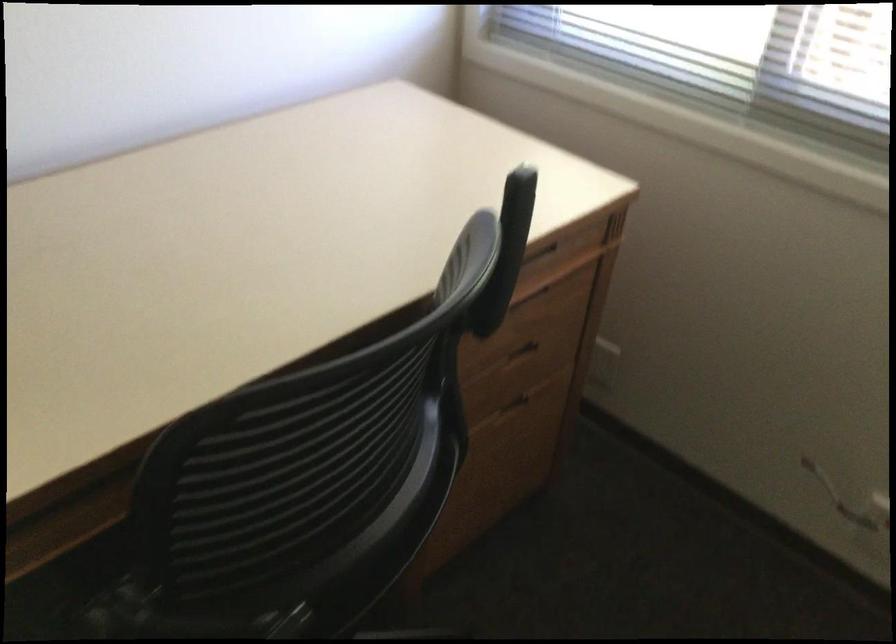
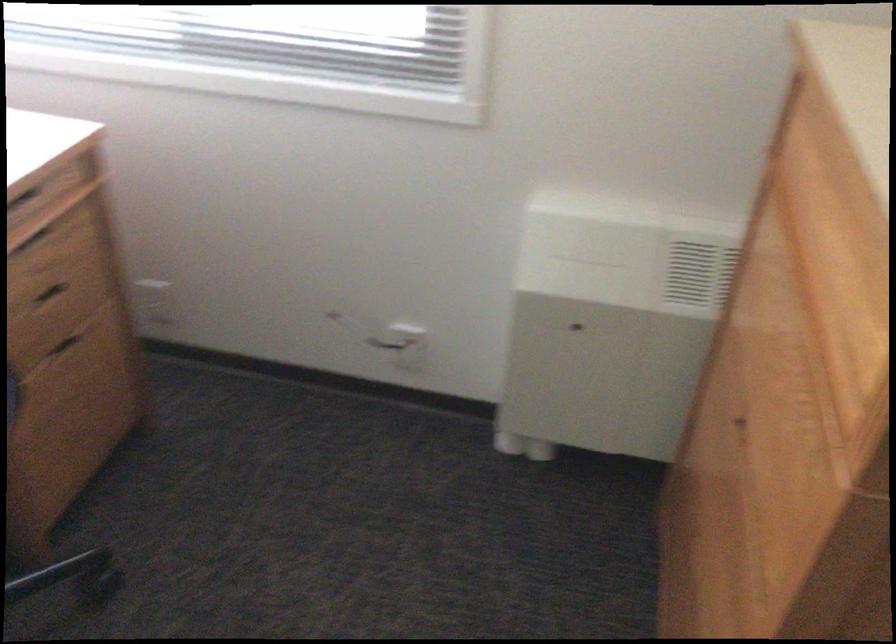
The point at (x=528, y=345) is marked in the first image. Where is the corresponding point in the second image?

(49, 292)